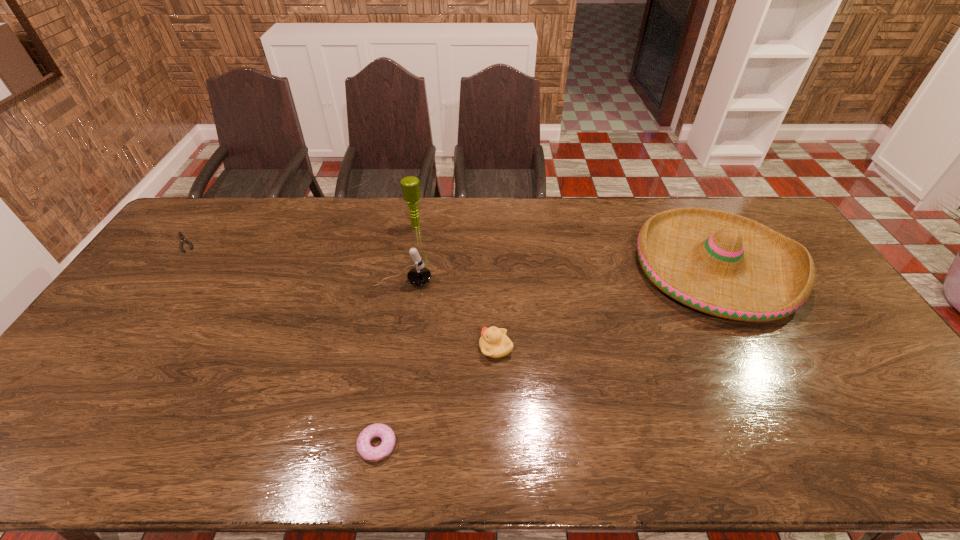
The width and height of the screenshot is (960, 540). In order to click on vacant space that's between the taller microphone and the rightmost object in this screenshot , I will do `click(565, 247)`.

I want to click on vacant space in between the rightmost object and the nearer microphone, so click(559, 274).

You are a GUI agent. You are given a task and a screenshot of the screen. Output one action in this format:
    pyautogui.click(x=<x>, y=<y>)
    Task: Click on the vacant point located between the shortest object and the sombrero
    
    Given the screenshot: What is the action you would take?
    pyautogui.click(x=450, y=254)

Locate an element on the screen. The height and width of the screenshot is (540, 960). free space between the shorter microphone and the sombrero is located at coordinates (559, 274).

This screenshot has width=960, height=540. In order to click on free space between the leftmost object and the farther microphone in this screenshot , I will do `click(300, 234)`.

Locate an element on the screen. The height and width of the screenshot is (540, 960). unoccupied area between the pliers and the nearer microphone is located at coordinates (294, 261).

Find the location of a particular element. The height and width of the screenshot is (540, 960). free spot between the shortest object and the fifth tallest object is located at coordinates (281, 343).

This screenshot has height=540, width=960. In order to click on free space between the taller microphone and the duckling in this screenshot , I will do `click(456, 287)`.

The width and height of the screenshot is (960, 540). Find the location of `free space between the shortest object and the nearer microphone`. free space between the shortest object and the nearer microphone is located at coordinates (294, 261).

Locate which object ranks third in proximity to the tallest object. Please provide its 2D coordinates. Your answer should be formatted as a tuple, i.e. [(x, y)], where the tuple contains the x and y coordinates of a point satisfying the conditions above.

[(719, 263)]